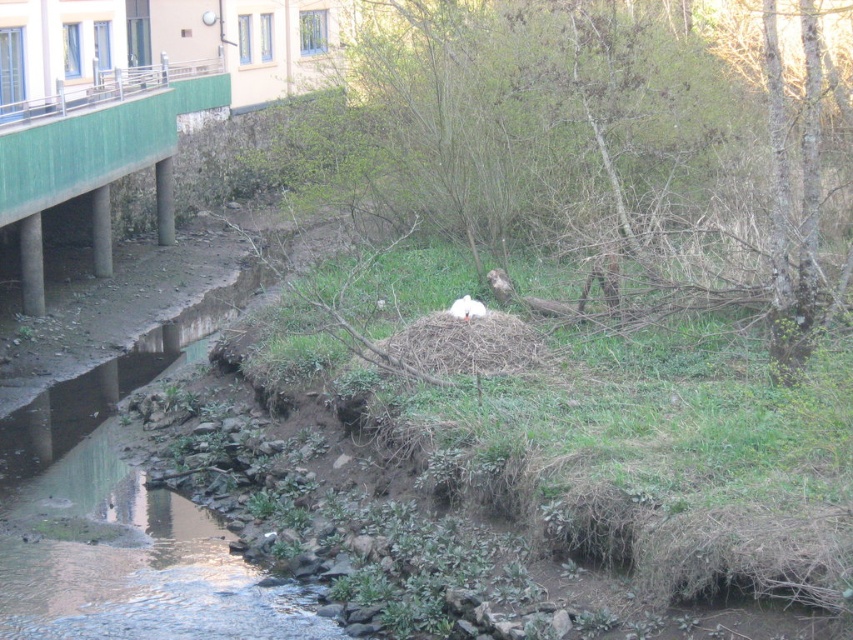
Question: Where is brown textured nest at center located in relation to white fluffy bird at center in the image?

Choices:
 (A) below
 (B) above

Answer: (B)

Question: Which point is closer to the camera?

Choices:
 (A) brown textured nest at center
 (B) white fluffy bird at center

Answer: (A)

Question: Can you confirm if brown textured nest at center is bigger than white fluffy bird at center?

Choices:
 (A) no
 (B) yes

Answer: (B)

Question: Which point appears farthest from the camera in this image?

Choices:
 (A) (471, 316)
 (B) (442, 192)

Answer: (B)

Question: Does brown textured nest at center come in front of white fluffy bird at center?

Choices:
 (A) yes
 (B) no

Answer: (A)